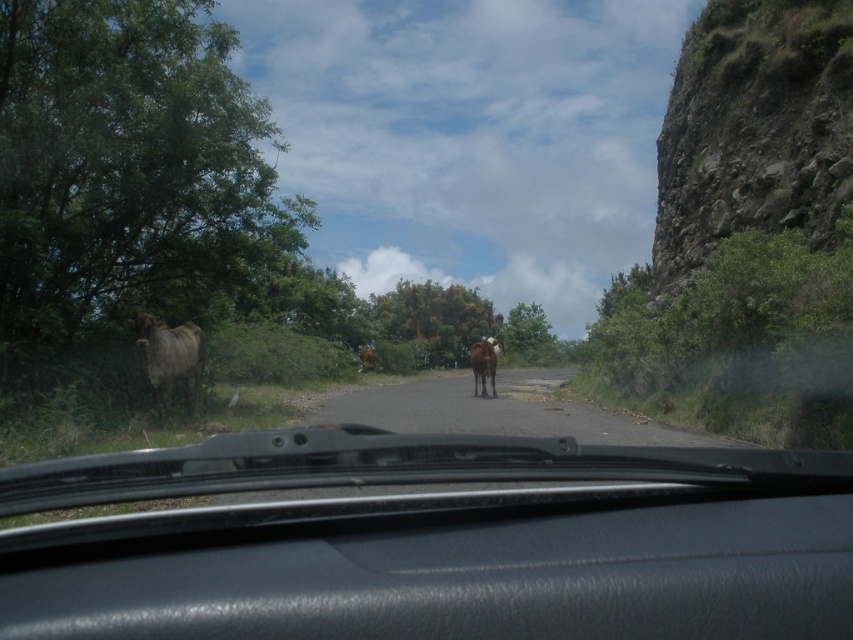
Question: Does brown dirt road at center appear over brown glossy cow at center?

Choices:
 (A) no
 (B) yes

Answer: (A)

Question: Considering the real-world distances, which object is farthest from the brown matte bull at left?

Choices:
 (A) black matte windshield wipers at center
 (B) brown dirt road at center

Answer: (B)

Question: Does black matte windshield wipers at center appear under brown dirt road at center?

Choices:
 (A) no
 (B) yes

Answer: (A)

Question: Does black matte windshield wipers at center have a larger size compared to brown glossy cow at center?

Choices:
 (A) yes
 (B) no

Answer: (B)

Question: Estimate the real-world distances between objects in this image. Which object is closer to the brown matte bull at left?

Choices:
 (A) brown dirt road at center
 (B) brown glossy cow at center
 (C) black matte windshield wipers at center

Answer: (C)

Question: Based on their relative distances, which object is farther from the black matte windshield wipers at center?

Choices:
 (A) brown matte bull at left
 (B) brown glossy cow at center

Answer: (B)